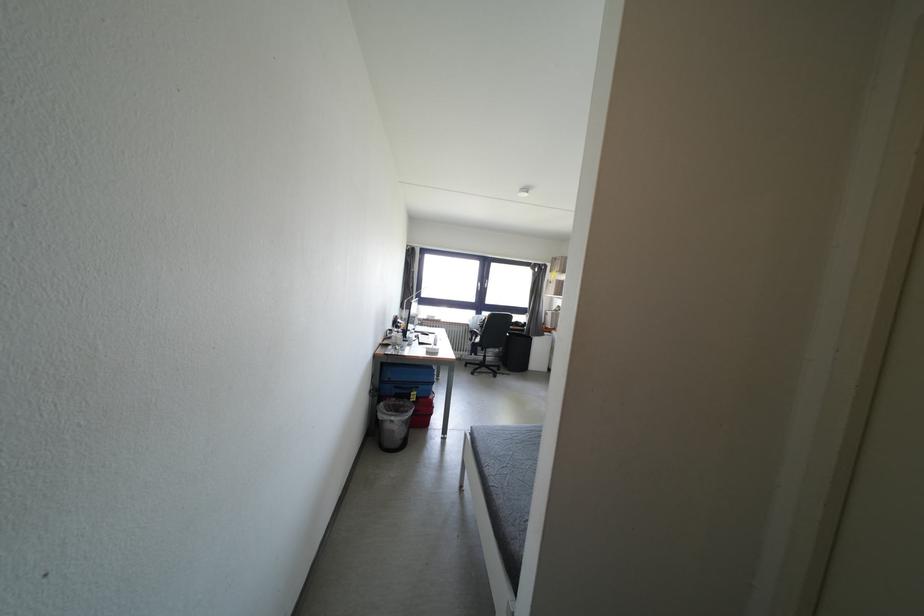
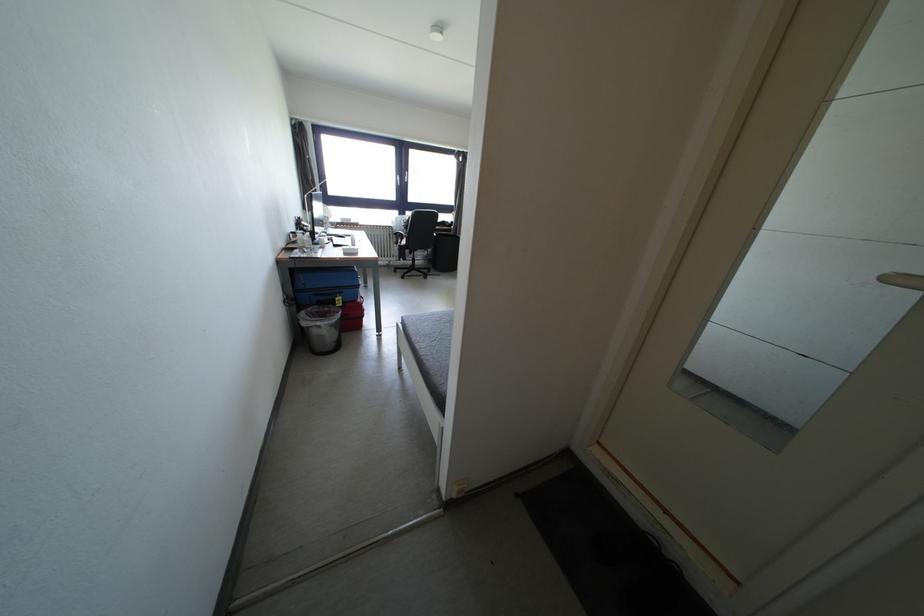
Locate, in the second image, the point that corresponds to pixel 421 390 in the first image.

(345, 294)